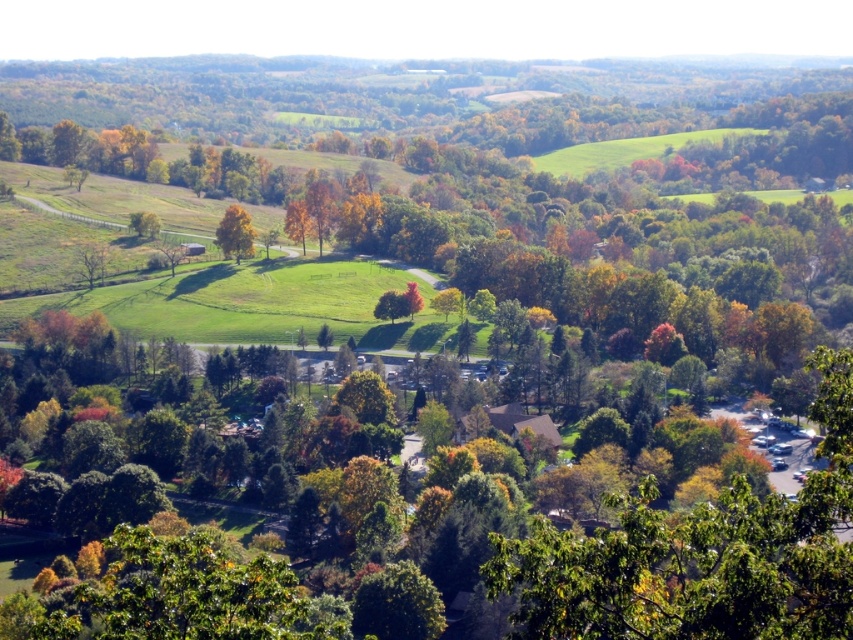
You are standing at the point labeled point (x=288, y=228) and want to walk towards the point labeled point (x=248, y=250). Given that both points are in the same landscape, which direction should you move to get closer to your destination?

Since point (x=248, y=250) is closer to the viewer than point (x=288, y=228), you should move forward towards the destination.

You are standing at the point marked as point (299, 221) in the image. What object are you directly facing?

You are directly facing the orange matte tree at center.